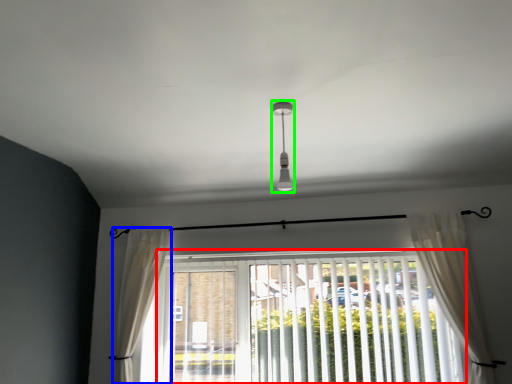
Question: Which is nearer to the window blind (highlighted by a red box)? curtain (highlighted by a blue box) or light fixture (highlighted by a green box).

Choices:
 (A) curtain
 (B) light fixture

Answer: (A)